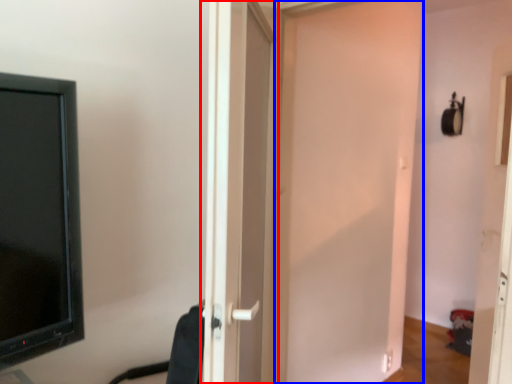
Question: Which object appears farthest to the camera in this image, door (highlighted by a red box) or door (highlighted by a blue box)?

Choices:
 (A) door
 (B) door

Answer: (B)